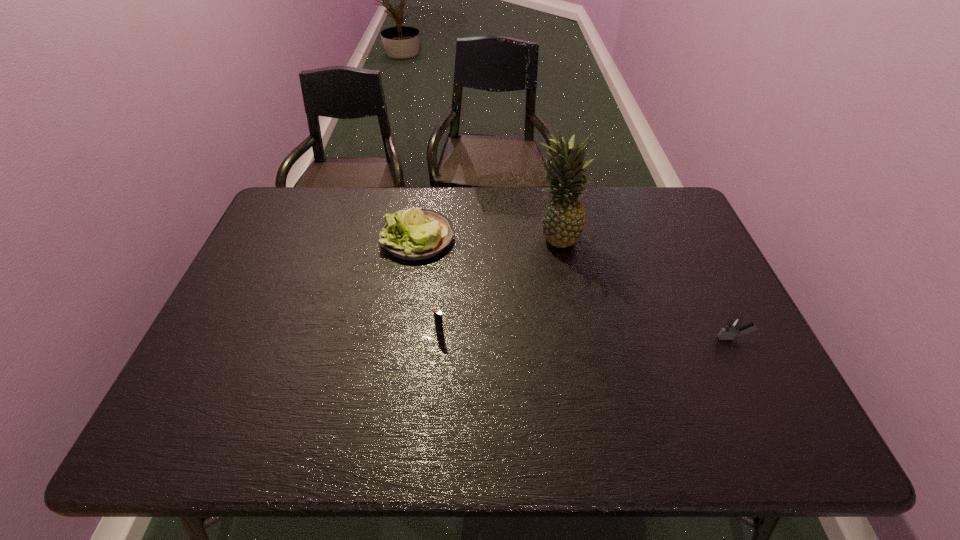
Image resolution: width=960 pixels, height=540 pixels. What are the coordinates of `the tallest object` in the screenshot? It's located at (563, 219).

The width and height of the screenshot is (960, 540). Identify the location of the third object from left to right. (563, 219).

Where is `lettuce`? The width and height of the screenshot is (960, 540). lettuce is located at coordinates (414, 234).

Where is `the left igniter`? The height and width of the screenshot is (540, 960). the left igniter is located at coordinates (437, 313).

Identify the location of the rightmost object. The image size is (960, 540). (734, 325).

Image resolution: width=960 pixels, height=540 pixels. I want to click on vacant space located on the left of the tallest object, so click(511, 236).

The height and width of the screenshot is (540, 960). Identify the location of vacant region located on the left of the lettuce. (342, 238).

This screenshot has width=960, height=540. In order to click on vacant space located 0.260m on the back of the left igniter in this screenshot , I will do `click(445, 258)`.

This screenshot has height=540, width=960. In order to click on free spot located 0.160m on the left of the rightmost object in this screenshot , I will do `click(655, 338)`.

I want to click on pineapple located in the far edge section of the desktop, so click(563, 219).